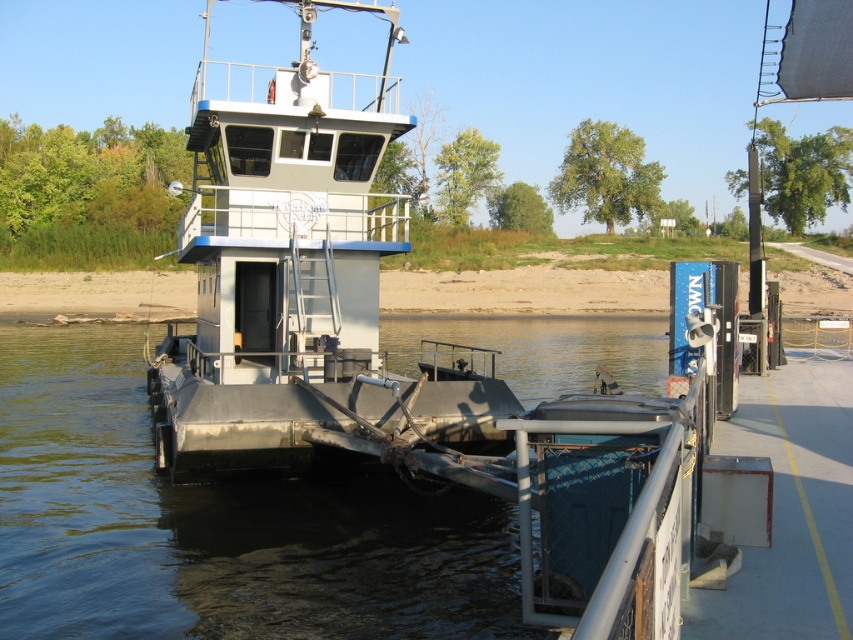
Who is more forward, (363, 484) or (393, 216)?

Positioned in front is point (363, 484).

Does metallic water at center have a greater height compared to metallic gray boat at center?

No, metallic water at center is not taller than metallic gray boat at center.

Which is in front, point (0, 397) or point (239, 396)?

Point (239, 396) is more forward.

This screenshot has width=853, height=640. In order to click on metallic water at center in this screenshot , I will do [213, 524].